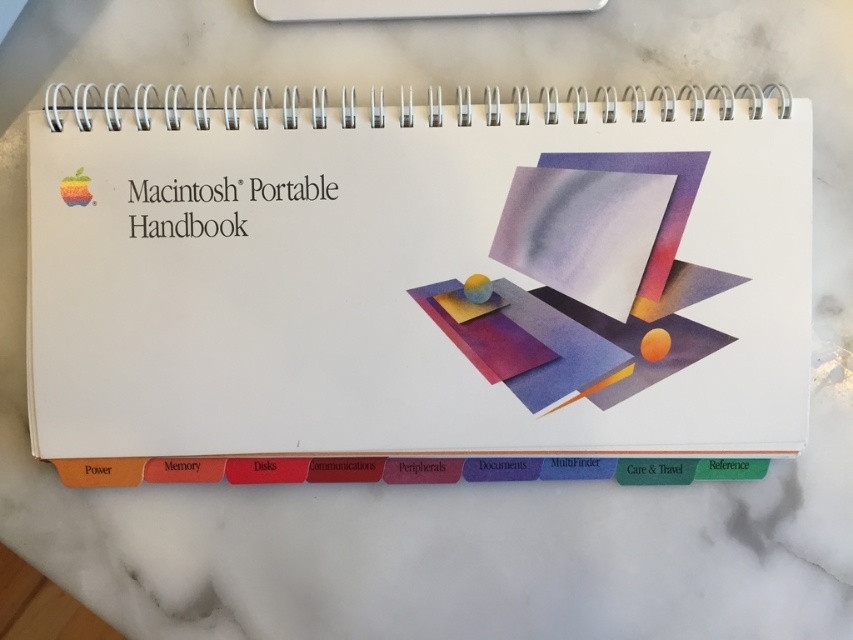
Can you confirm if white paper at center is bigger than white plastic ruler at upper center?

Yes, white paper at center is bigger than white plastic ruler at upper center.

How much distance is there between white paper at center and white plastic ruler at upper center?

7.93 inches

Is point (625, 346) behind point (589, 3)?

That is False.

Find the location of a particular element. Image resolution: width=853 pixels, height=640 pixels. white paper at center is located at coordinates (419, 276).